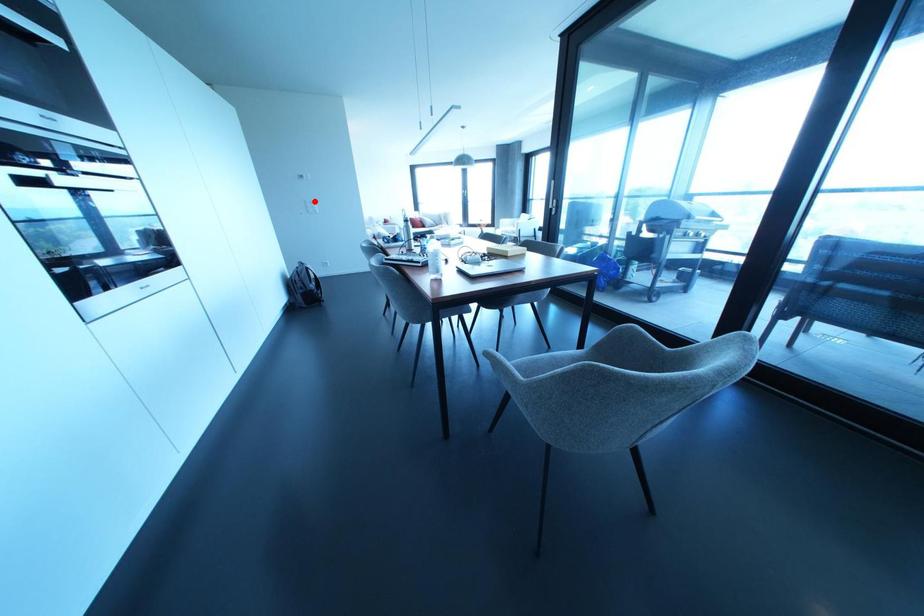
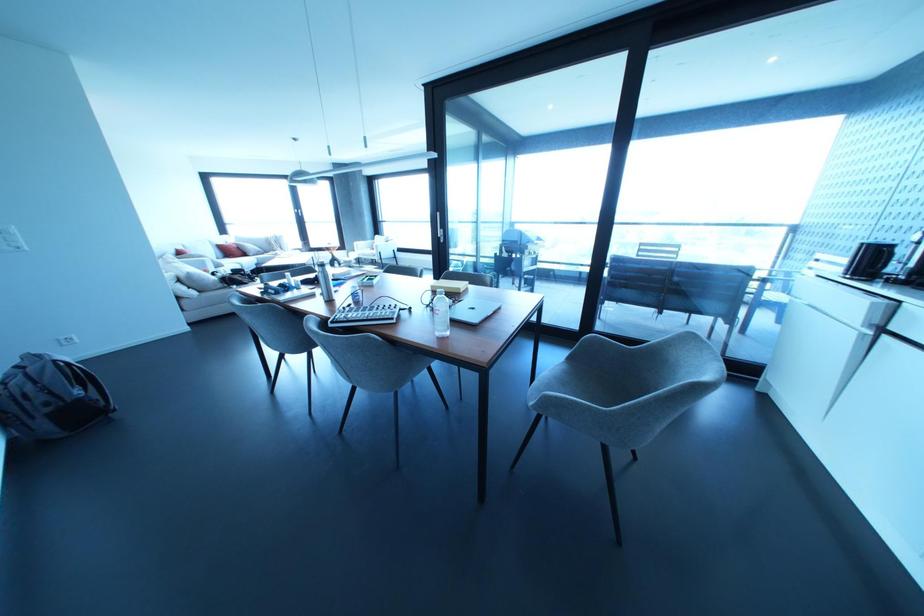
Where in the second image is the point corresponding to the highlighted location from the first image?

(14, 229)